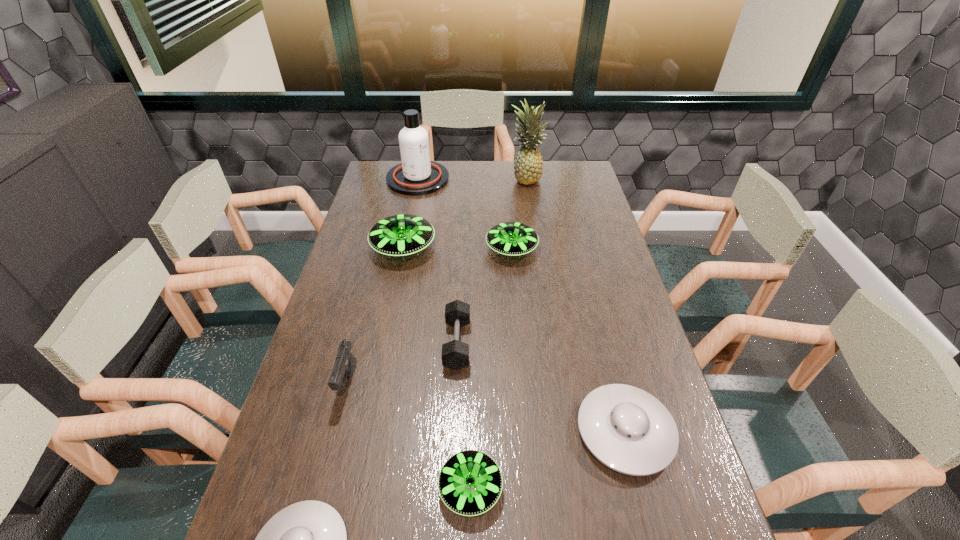
Locate an element on the screen. the second closest green saucer to the tallest saucer is located at coordinates (470, 482).

Identify the location of gray saucer that can be found as the closest to the green pineapple. (627, 429).

Locate which gray saucer ranks in proximity to the smallest green saucer. Please provide its 2D coordinates. Your answer should be formatted as a tuple, i.e. [(x, y)], where the tuple contains the x and y coordinates of a point satisfying the conditions above.

[(308, 539)]

Locate an element on the screen. This screenshot has height=540, width=960. vacant space that satisfies the following two spatial constraints: 1. on the front side of the second tallest saucer; 2. on the right side of the tallest saucer is located at coordinates (403, 249).

Image resolution: width=960 pixels, height=540 pixels. What are the coordinates of `vacant space that satisfies the following two spatial constraints: 1. at the barrel of the bigger gray saucer; 2. on the right side of the pistol` in the screenshot? It's located at (336, 432).

Where is `free point that satisfies the following two spatial constraints: 1. on the back side of the eighth shortest object; 2. on the right side of the biggest green saucer`? This screenshot has height=540, width=960. free point that satisfies the following two spatial constraints: 1. on the back side of the eighth shortest object; 2. on the right side of the biggest green saucer is located at coordinates (417, 179).